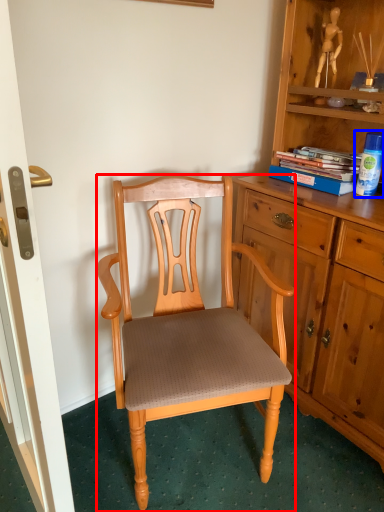
Question: Which object appears closest to the camera in this image, chair (highlighted by a red box) or toy (highlighted by a blue box)?

Choices:
 (A) chair
 (B) toy

Answer: (A)